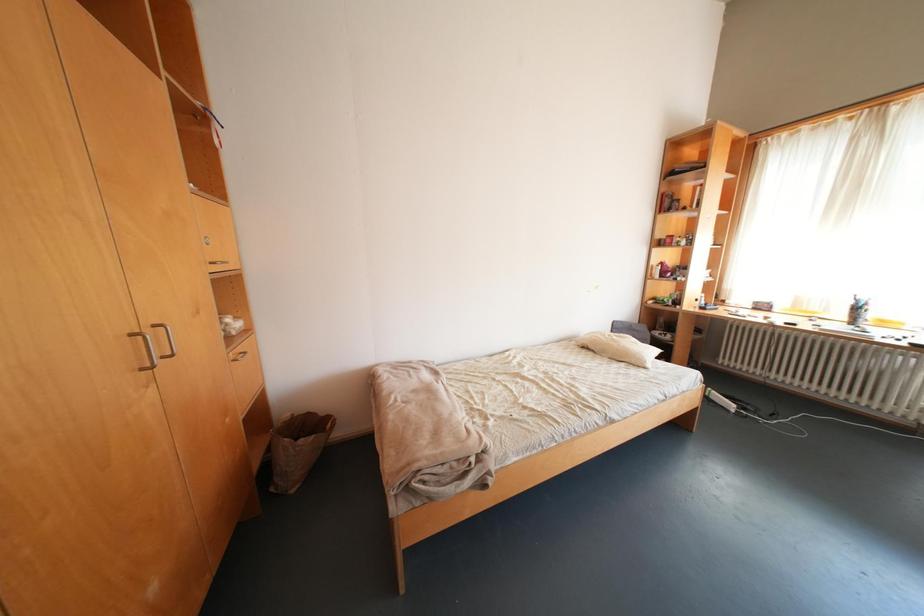
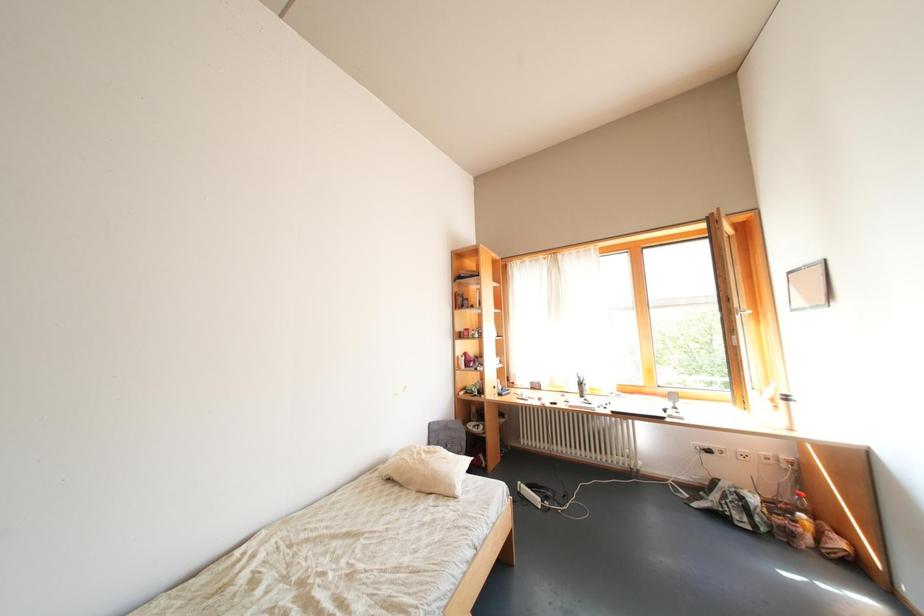
The first image is from the beginning of the video and the second image is from the end. How did the camera likely rotate when shooting the video?

The camera rotated toward right-up.